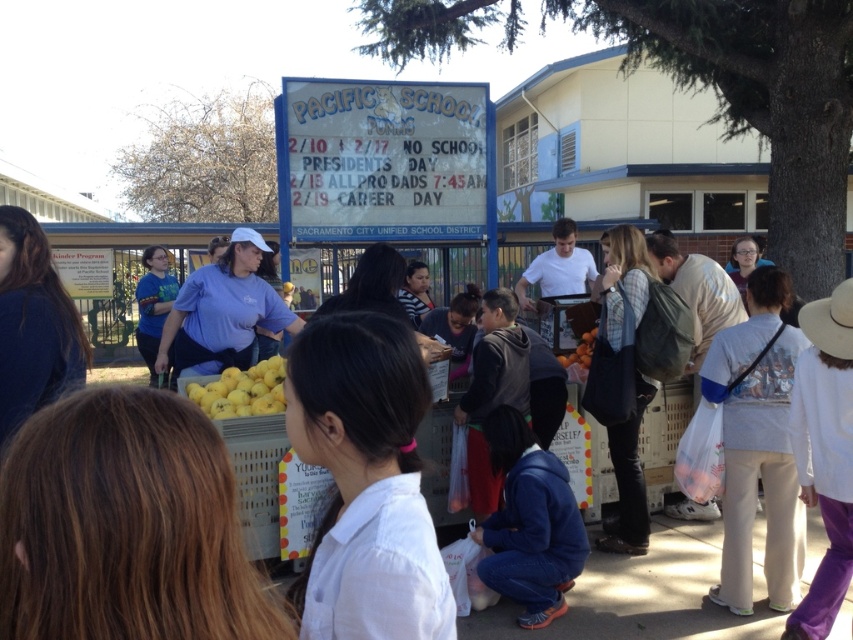
You are standing at the fruit stand at Pacific School and need to locate two points marked on the ground for setting up equipment. The points are labeled as point 1 at coordinates (259, 365) and point 2 at (581, 378). According to the spatial arrangement, which point is closer to you when facing the fruit stand?

Point 1 at coordinates (259, 365) is in front of point 2 at (581, 378), so it is closer to you when facing the fruit stand.